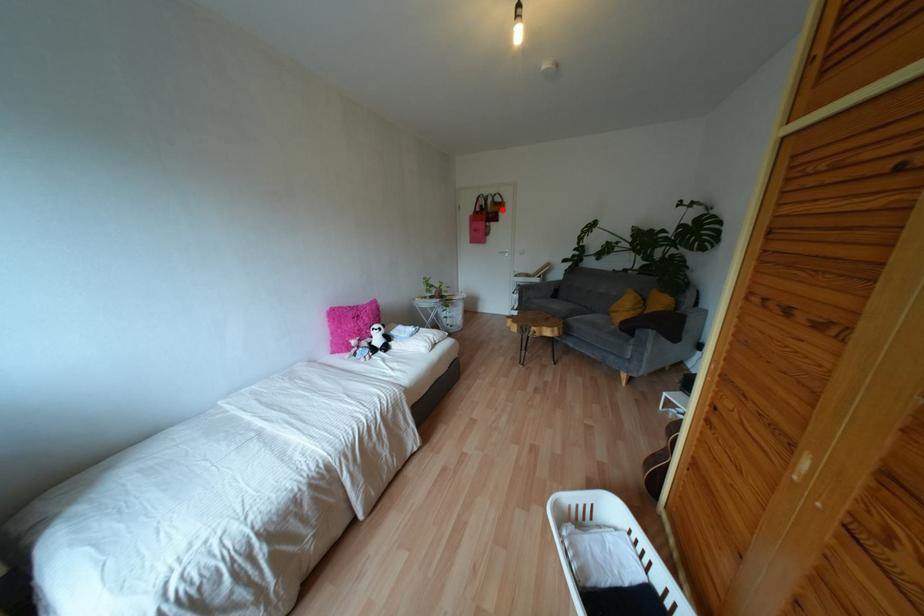
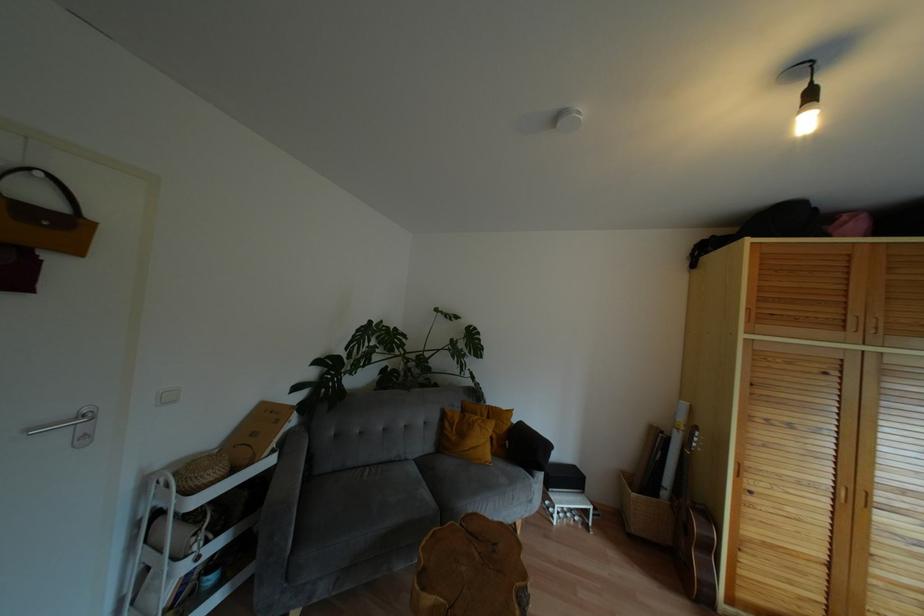
Question: I am providing you with two images of the same scene from different viewpoints. Given a red point in image1, look at the same physical point in image2. Is it:

Choices:
 (A) Closer to the viewpoint
 (B) Farther from the viewpoint

Answer: (B)